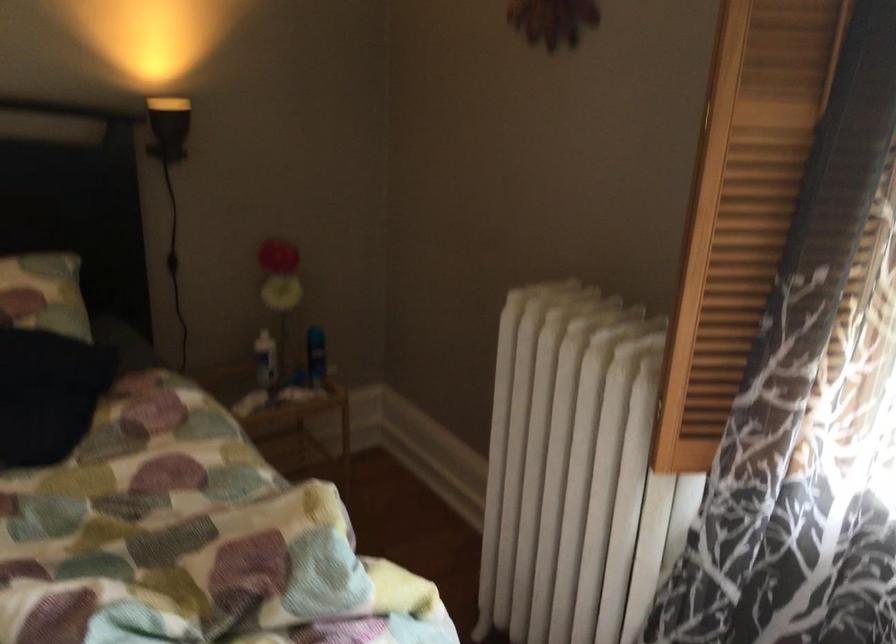
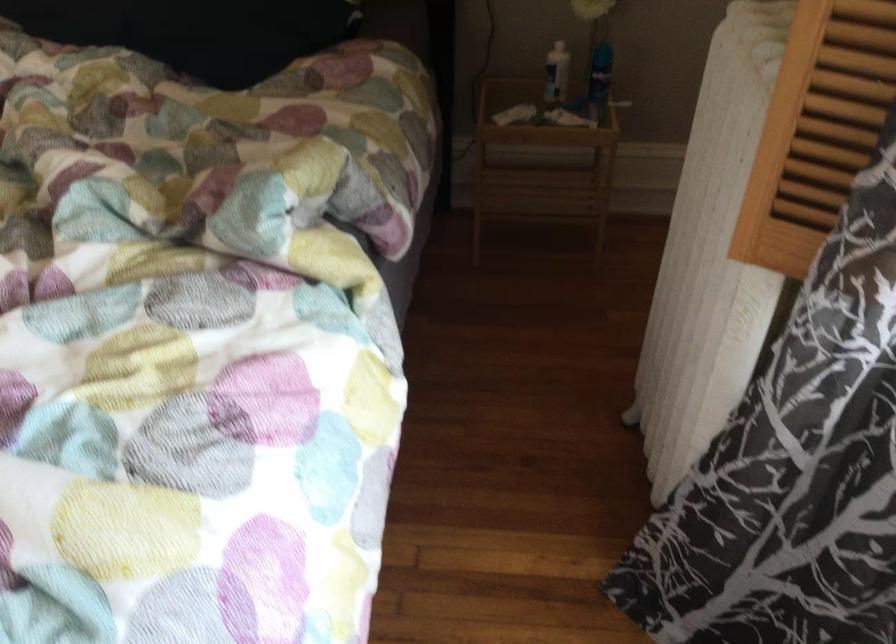
The images are taken continuously from a first-person perspective. In which direction is your viewpoint rotating?

The rotation direction of the camera is left-down.